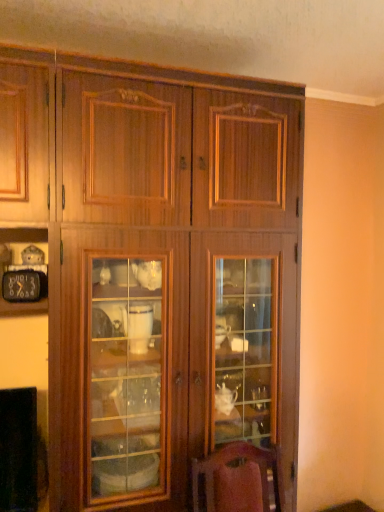
What do you see at coordinates (158, 267) in the screenshot? I see `wooden cabinet at center` at bounding box center [158, 267].

Locate an element on the screen. The image size is (384, 512). wooden cabinet at center is located at coordinates click(158, 267).

What is the approximate height of wooden cabinet at center?

wooden cabinet at center is 1.90 meters tall.

At what (x,y) coordinates should I click in order to perform the action: click on metallic black clock at left. Please return your answer as a coordinate pair (x, y). The height and width of the screenshot is (512, 384). Looking at the image, I should click on (21, 286).

The height and width of the screenshot is (512, 384). What do you see at coordinates (21, 286) in the screenshot? I see `metallic black clock at left` at bounding box center [21, 286].

Measure the distance between metallic black clock at left and camera.

They are 1.49 meters apart.

Where is `wooden cabinet at center`? This screenshot has height=512, width=384. wooden cabinet at center is located at coordinates (158, 267).

Is metallic black clock at left at the right side of wooden cabinet at center?

No, metallic black clock at left is not to the right of wooden cabinet at center.

Which is in front, metallic black clock at left or wooden cabinet at center?

Positioned in front is wooden cabinet at center.

Which is farther, [5,282] or [190,168]?

Point [5,282]

From the image's perspective, which is below, metallic black clock at left or wooden cabinet at center?

wooden cabinet at center appears lower in the image.

From a real-world perspective, is metallic black clock at left on wooden cabinet at center?

Indeed, from a real-world perspective, metallic black clock at left stands above wooden cabinet at center.

Is metallic black clock at left thinner than wooden cabinet at center?

Correct, the width of metallic black clock at left is less than that of wooden cabinet at center.

In terms of height, does metallic black clock at left look taller or shorter compared to wooden cabinet at center?

Considering their sizes, metallic black clock at left has less height than wooden cabinet at center.

In the scene shown: In terms of size, does metallic black clock at left appear bigger or smaller than wooden cabinet at center?

In the image, metallic black clock at left appears to be smaller than wooden cabinet at center.

Choose the correct answer: Is metallic black clock at left inside wooden cabinet at center or outside it?

metallic black clock at left is inside wooden cabinet at center.

Is metallic black clock at left next to wooden cabinet at center and touching it?

metallic black clock at left and wooden cabinet at center are clearly separated.

Is metallic black clock at left oriented away from wooden cabinet at center?

Yes, metallic black clock at left is facing away from wooden cabinet at center.

How far apart are metallic black clock at left and wooden cabinet at center?

metallic black clock at left is 24.82 inches from wooden cabinet at center.

I want to click on clock above the wooden cabinet at center (from a real-world perspective), so click(x=21, y=286).

Which object is positioned more to the right, wooden cabinet at center or metallic black clock at left?

wooden cabinet at center is more to the right.

Is wooden cabinet at center in front of or behind metallic black clock at left in the image?

In the image, wooden cabinet at center appears in front of metallic black clock at left.

Does point (90, 204) come closer to viewer compared to point (39, 284)?

Yes, it is.

From the image's perspective, who appears lower, wooden cabinet at center or metallic black clock at left?

A: From the image's view, wooden cabinet at center is below.

From a real-world perspective, between wooden cabinet at center and metallic black clock at left, who is vertically higher?

metallic black clock at left is physically above.

Considering the relative sizes of wooden cabinet at center and metallic black clock at left in the image provided, is wooden cabinet at center thinner than metallic black clock at left?

No, wooden cabinet at center is not thinner than metallic black clock at left.

Is wooden cabinet at center taller or shorter than metallic black clock at left?

In the image, wooden cabinet at center appears to be taller than metallic black clock at left.

Between wooden cabinet at center and metallic black clock at left, which one has smaller size?

Smaller between the two is metallic black clock at left.

Would you say wooden cabinet at center is outside metallic black clock at left?

wooden cabinet at center is positioned outside metallic black clock at left.

Looking at this image, is wooden cabinet at center placed right next to metallic black clock at left?

wooden cabinet at center and metallic black clock at left are not in contact.

Does wooden cabinet at center turn towards metallic black clock at left?

Yes, wooden cabinet at center is facing metallic black clock at left.

Where is `clock above the wooden cabinet at center (from a real-world perspective)`? The width and height of the screenshot is (384, 512). clock above the wooden cabinet at center (from a real-world perspective) is located at coordinates (21, 286).

Image resolution: width=384 pixels, height=512 pixels. What are the coordinates of `cupboard below the metallic black clock at left (from the image's perspective)` in the screenshot? It's located at (158, 267).

This screenshot has width=384, height=512. I want to click on cupboard that appears in front of the metallic black clock at left, so click(x=158, y=267).